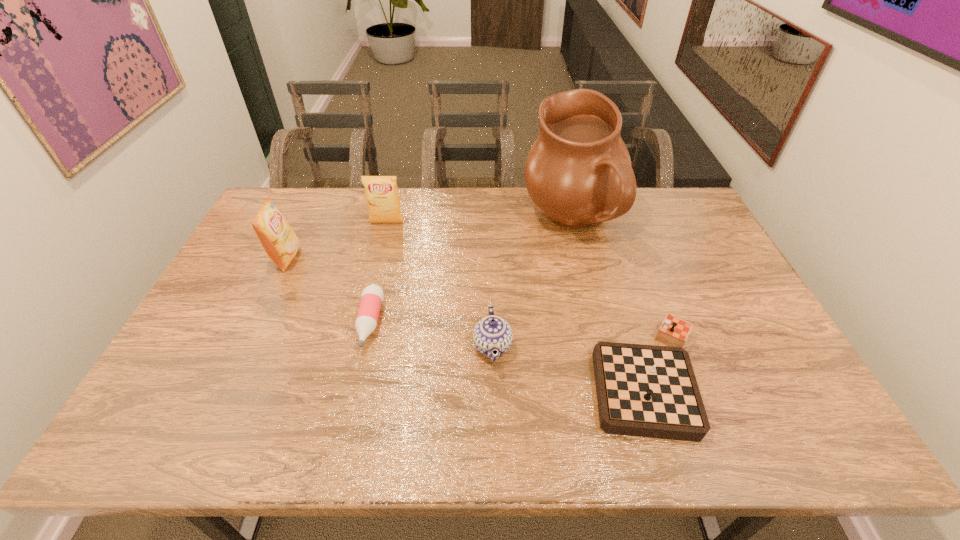
Find the location of a particular element. This screenshot has height=540, width=960. object positioned at the near edge is located at coordinates (642, 390).

Find the location of a particular element. This screenshot has height=540, width=960. object located at the left edge is located at coordinates (280, 242).

In the image, there is a desktop. Where is `vacant space at the far edge`? This screenshot has width=960, height=540. vacant space at the far edge is located at coordinates (358, 207).

At what (x,y) coordinates should I click in order to perform the action: click on free space at the near edge of the desktop. Please return your answer as a coordinate pair (x, y). The width and height of the screenshot is (960, 540). Looking at the image, I should click on (281, 426).

You are a GUI agent. You are given a task and a screenshot of the screen. Output one action in this format:
    pyautogui.click(x=<x>, y=<y>)
    Task: Click on the vacant space at the right edge
    
    Given the screenshot: What is the action you would take?
    pyautogui.click(x=694, y=274)

Identify the location of vacant space at the far right corner of the desktop. (685, 198).

Identify the location of vacant area between the tallest object and the fourth object from left to right. Image resolution: width=960 pixels, height=540 pixels. 533,284.

Find the location of a particular element. unoccupied area between the right crisp (potato chip) and the left crisp (potato chip) is located at coordinates (337, 240).

Image resolution: width=960 pixels, height=540 pixels. Find the location of `vacant area that lies between the cream pitcher and the nearer crisp (potato chip)`. vacant area that lies between the cream pitcher and the nearer crisp (potato chip) is located at coordinates (429, 240).

Find the location of a particular element. The height and width of the screenshot is (540, 960). vacant area that lies between the shortest object and the cream pitcher is located at coordinates (471, 272).